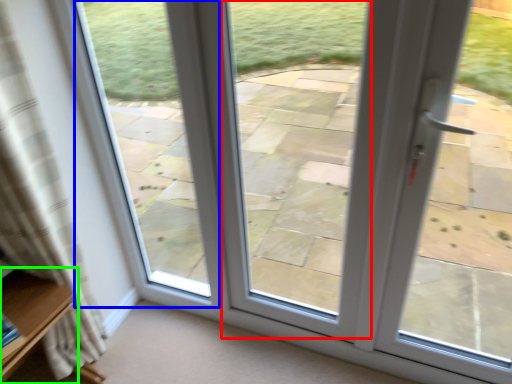
Question: Based on their relative distances, which object is nearer to window (highlighted by a red box)? Choose from bay window (highlighted by a blue box) and furniture (highlighted by a green box).

Choices:
 (A) bay window
 (B) furniture

Answer: (A)